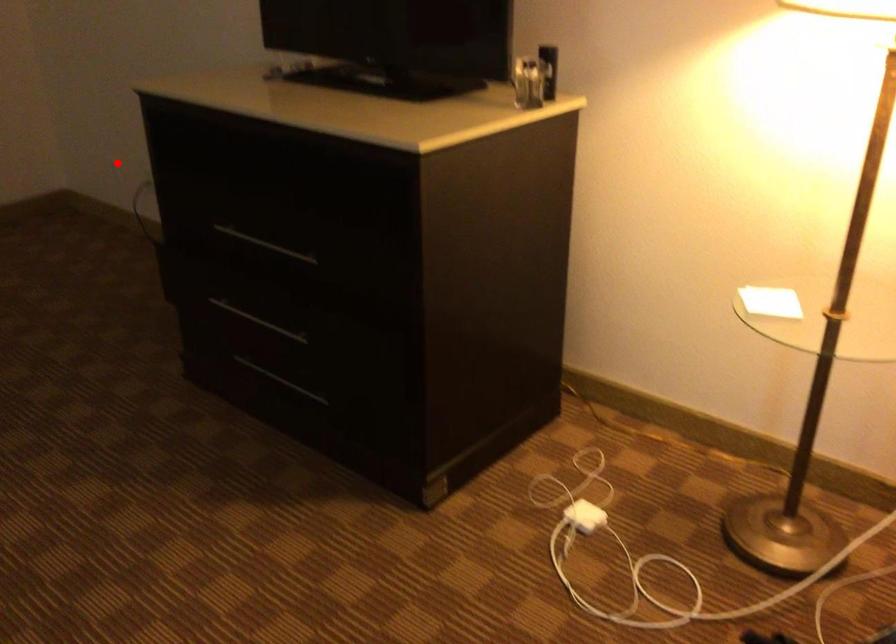
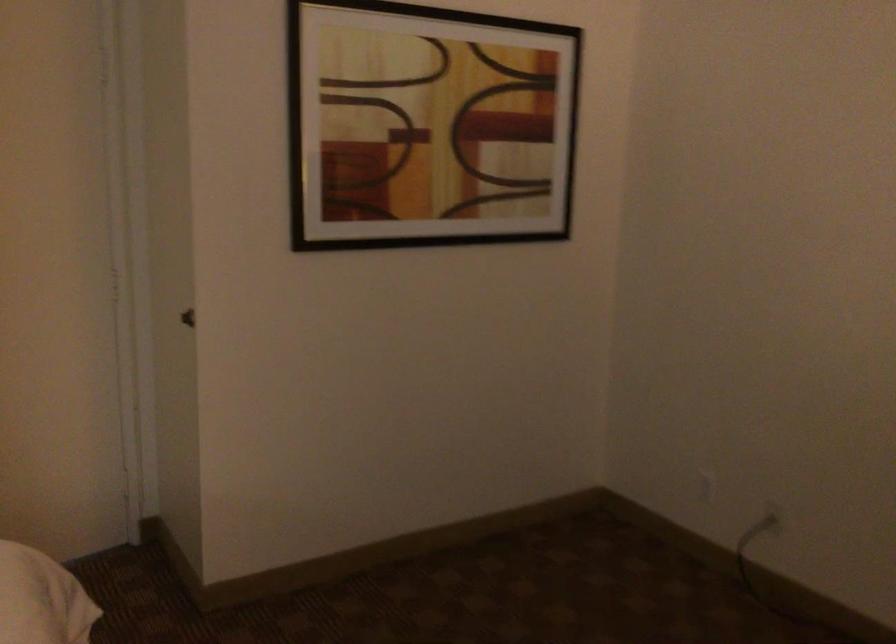
Question: I am providing you with two images of the same scene from different viewpoints. A red point is shown in image1. For the corresponding object point in image2, is it positioned nearer or farther from the camera?

Choices:
 (A) Nearer
 (B) Farther

Answer: (A)